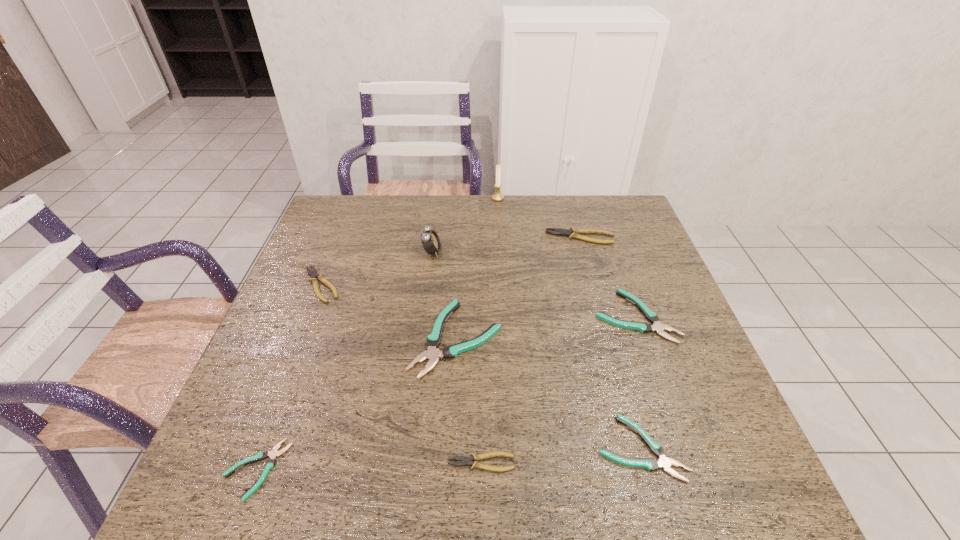
This screenshot has width=960, height=540. What are the coordinates of `free space that is in between the second smallest yellow pliers and the tallest object` in the screenshot? It's located at (410, 241).

You are a GUI agent. You are given a task and a screenshot of the screen. Output one action in this format:
    pyautogui.click(x=<x>, y=<y>)
    Task: Click on the unoccupied position between the second smallest yellow pliers and the leftmost teal pliers
    
    Given the screenshot: What is the action you would take?
    pyautogui.click(x=289, y=377)

This screenshot has height=540, width=960. I want to click on free point between the alarm clock and the second biggest teal pliers, so click(534, 284).

You are a GUI agent. You are given a task and a screenshot of the screen. Output one action in this format:
    pyautogui.click(x=<x>, y=<y>)
    Task: Click on the free space between the second smallest teal pliers and the second biggest teal pliers
    The width and height of the screenshot is (960, 540).
    Given the screenshot: What is the action you would take?
    pyautogui.click(x=637, y=382)

The width and height of the screenshot is (960, 540). In order to click on vacant region between the leftmost yellow pliers and the third biggest teal pliers in this screenshot , I will do `click(481, 366)`.

Where is `free space that is in between the leftmost yellow pliers and the second yellow pliers from right to left`? Image resolution: width=960 pixels, height=540 pixels. free space that is in between the leftmost yellow pliers and the second yellow pliers from right to left is located at coordinates (401, 374).

In order to click on object that is the third closest to the rightmost yellow pliers in this screenshot , I will do `click(432, 354)`.

Locate an element on the screen. The width and height of the screenshot is (960, 540). object that ranks as the fifth closest to the farthest object is located at coordinates (314, 275).

Locate which pliers ranks seventh in proximity to the alarm clock. Please provide its 2D coordinates. Your answer should be formatted as a tuple, i.e. [(x, y)], where the tuple contains the x and y coordinates of a point satisfying the conditions above.

[(650, 464)]

Point out which pliers is positioned as the second nearest to the farthest object. Please provide its 2D coordinates. Your answer should be formatted as a tuple, i.e. [(x, y)], where the tuple contains the x and y coordinates of a point satisfying the conditions above.

[(432, 354)]